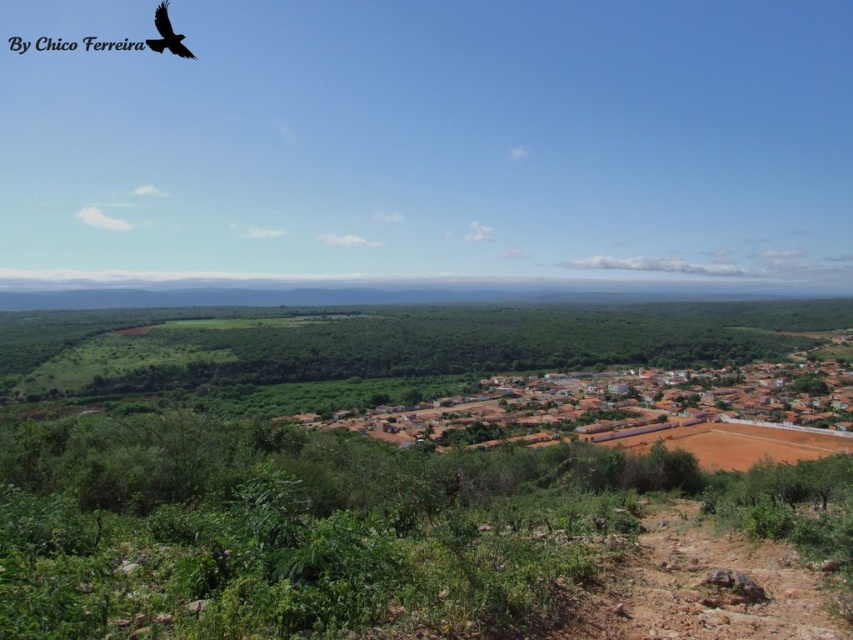
Question: Which point appears farthest from the camera in this image?

Choices:
 (A) (152, 42)
 (B) (722, 369)

Answer: (B)

Question: Which object is closer to the camera taking this photo?

Choices:
 (A) brown clay houses at center
 (B) black feathered bird at upper left

Answer: (B)

Question: Does brown clay houses at center appear on the right side of black feathered bird at upper left?

Choices:
 (A) no
 (B) yes

Answer: (B)

Question: In this image, where is brown clay houses at center located relative to black feathered bird at upper left?

Choices:
 (A) below
 (B) above

Answer: (A)

Question: Is brown clay houses at center to the right of black feathered bird at upper left from the viewer's perspective?

Choices:
 (A) no
 (B) yes

Answer: (B)